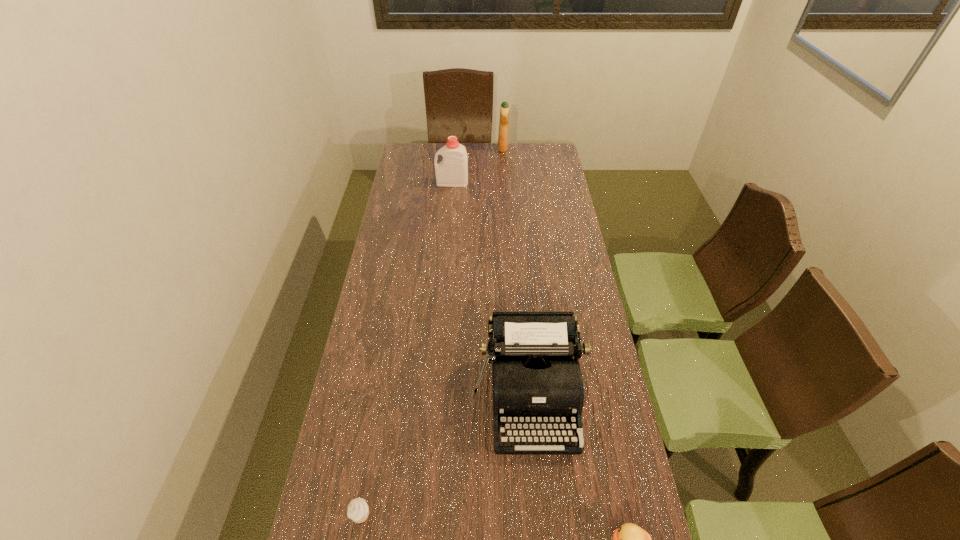
Find the location of a particular element. The height and width of the screenshot is (540, 960). the farther detergent is located at coordinates (503, 145).

At what (x,y) coordinates should I click in order to perform the action: click on the farthest object. Please return your answer as a coordinate pair (x, y). Looking at the image, I should click on (503, 145).

At what (x,y) coordinates should I click in order to perform the action: click on the fourth object from right to left. Please return your answer as a coordinate pair (x, y). This screenshot has width=960, height=540. Looking at the image, I should click on (452, 171).

What are the coordinates of `the fourth nearest object` in the screenshot? It's located at (452, 171).

At what (x,y) coordinates should I click in order to perform the action: click on typewriter. Please return your answer as a coordinate pair (x, y). Looking at the image, I should click on (536, 377).

I want to click on the third shortest object, so click(x=536, y=377).

Where is `the leftmost object`? This screenshot has width=960, height=540. the leftmost object is located at coordinates (358, 510).

Image resolution: width=960 pixels, height=540 pixels. I want to click on the fourth tallest object, so click(358, 510).

Find the location of `blank space located 0.200m on the label of the farther detergent`. blank space located 0.200m on the label of the farther detergent is located at coordinates (460, 148).

Locate an element on the screen. free space located on the label of the farther detergent is located at coordinates (471, 148).